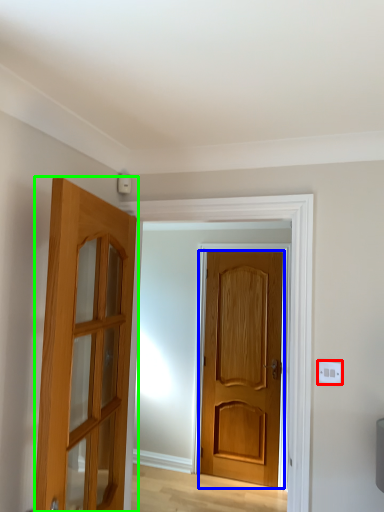
Question: Based on their relative distances, which object is farther from electric outlet (highlighted by a red box)? Choose from door (highlighted by a blue box) and door (highlighted by a green box).

Choices:
 (A) door
 (B) door

Answer: (A)